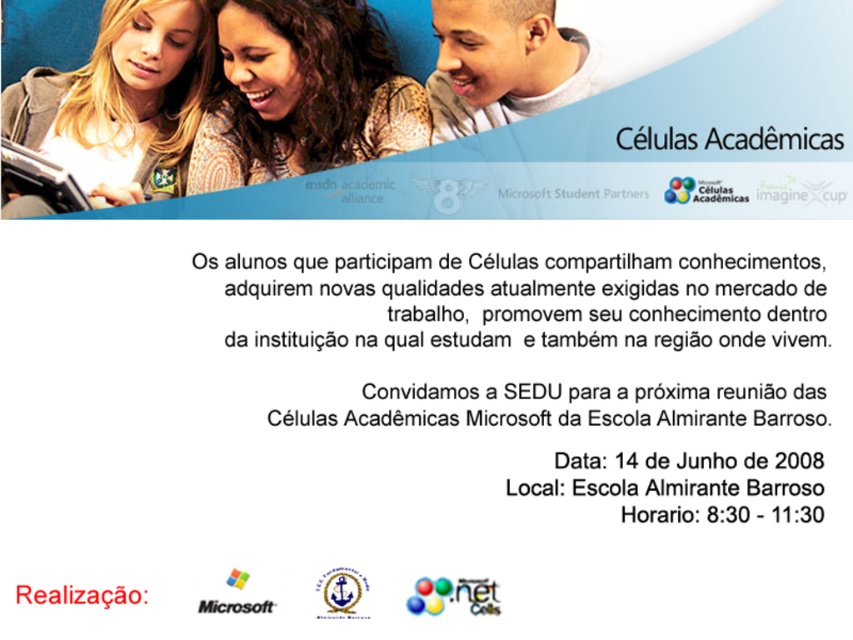
Question: Can you confirm if white paper at center is bigger than redtextrealização at upper center?

Choices:
 (A) no
 (B) yes

Answer: (B)

Question: Among these points, which one is farthest from the camera?

Choices:
 (A) (28, 598)
 (B) (480, 52)
 (C) (500, 413)
 (D) (791, 132)

Answer: (B)

Question: Is brown textured sweater at upper center thinner than black matte microsoft logo at upper center?

Choices:
 (A) no
 (B) yes

Answer: (A)

Question: Which object appears closest to the camera in this image?

Choices:
 (A) white paper at center
 (B) redtextrealização at upper center
 (C) matte black laptop at upper center
 (D) black matte microsoft logo at upper center

Answer: (B)

Question: Which point appears closest to the camera in this image?

Choices:
 (A) click(26, 124)
 (B) click(833, 317)
 (C) click(270, 600)
 (D) click(838, 145)

Answer: (D)

Question: Does matte black laptop at left have a greater width compared to matte black laptop at upper center?

Choices:
 (A) no
 (B) yes

Answer: (B)